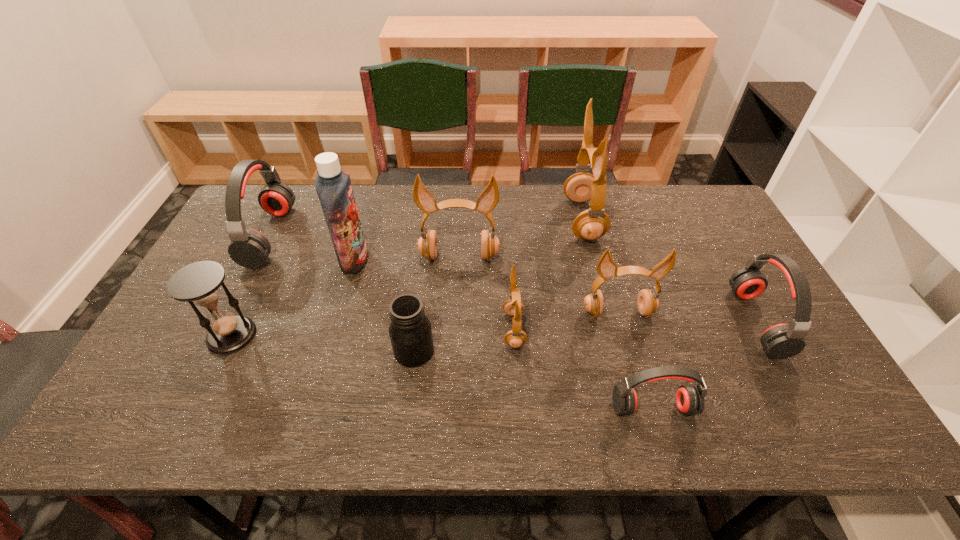
Locate an element on the screen. The width and height of the screenshot is (960, 540). the third closest earphone relative to the second smallest brown earphone is located at coordinates (591, 224).

At what (x,y) coordinates should I click in order to perform the action: click on brown earphone that is the second nearest to the shortest earphone. Please return your answer as a coordinate pair (x, y). The width and height of the screenshot is (960, 540). Looking at the image, I should click on (514, 306).

Choose which brown earphone is the nearest neighbor to the smallest red earphone. Please provide its 2D coordinates. Your answer should be formatted as a tuple, i.e. [(x, y)], where the tuple contains the x and y coordinates of a point satisfying the conditions above.

[(648, 303)]

Identify which red earphone is located as the second nearest to the nearest red earphone. Please provide its 2D coordinates. Your answer should be formatted as a tuple, i.e. [(x, y)], where the tuple contains the x and y coordinates of a point satisfying the conditions above.

[(249, 248)]

I want to click on red earphone that stands as the closest to the rightmost earphone, so click(x=689, y=398).